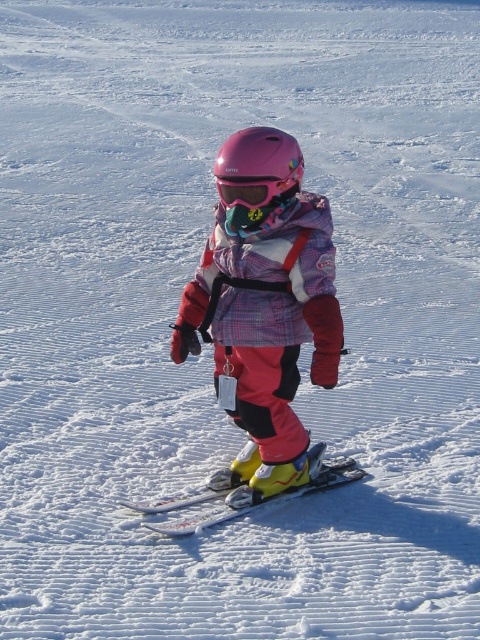
Question: Is matte pink helmet at center thinner than yellow matte ski at center?

Choices:
 (A) yes
 (B) no

Answer: (A)

Question: Is pink matte helmet at center closer to camera compared to yellow matte ski at center?

Choices:
 (A) yes
 (B) no

Answer: (A)

Question: Is matte pink helmet at center bigger than yellow matte ski at center?

Choices:
 (A) yes
 (B) no

Answer: (A)

Question: Based on their relative distances, which object is nearer to the pink matte/glossy goggles at center?

Choices:
 (A) pink matte helmet at center
 (B) matte pink helmet at center

Answer: (A)

Question: Which object appears farthest from the camera in this image?

Choices:
 (A) pink matte helmet at center
 (B) pink matte/glossy goggles at center
 (C) yellow matte ski at center

Answer: (C)

Question: Which point is closer to the camera taking this photo?

Choices:
 (A) (223, 196)
 (B) (239, 182)
 (C) (273, 220)
 (D) (242, 486)

Answer: (B)